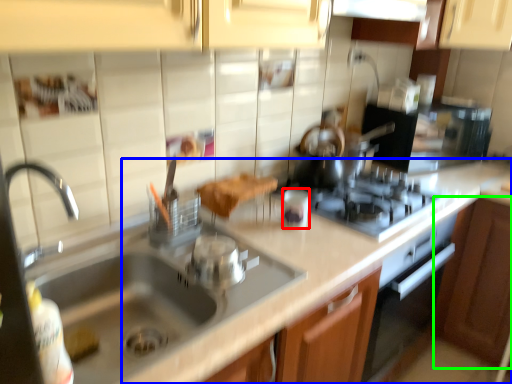
Question: Which is farther away from appliance (highlighted by a red box)? counter top (highlighted by a blue box) or cabinetry (highlighted by a green box)?

Choices:
 (A) counter top
 (B) cabinetry

Answer: (B)